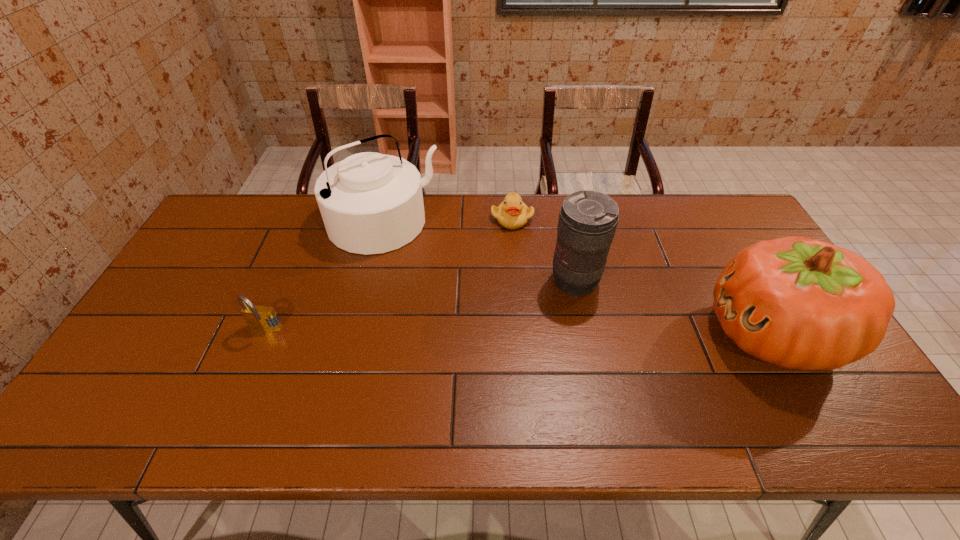
At what (x,y) coordinates should I click in order to perform the action: click on vacant region between the telephoto lens and the shortest object. Please return your answer as a coordinate pair (x, y). The width and height of the screenshot is (960, 540). Looking at the image, I should click on (543, 249).

Select which object is the closest to the rightmost object. Please provide its 2D coordinates. Your answer should be formatted as a tuple, i.e. [(x, y)], where the tuple contains the x and y coordinates of a point satisfying the conditions above.

[(587, 222)]

The image size is (960, 540). What are the coordinates of `object that is the fourth closest to the leftmost object` in the screenshot? It's located at (799, 303).

You are a GUI agent. You are given a task and a screenshot of the screen. Output one action in this format:
    pyautogui.click(x=<x>, y=<y>)
    Task: Click on the vacant space that satisfies the following two spatial constraints: 1. on the side with the combination dials of the rightmost object; 2. on the side of the padlock with the cute face
    
    Given the screenshot: What is the action you would take?
    pyautogui.click(x=263, y=334)

Identify the location of vacant space that satisfies the following two spatial constraints: 1. on the front side of the pumpkin; 2. on the side of the duckling with the cute face. The image size is (960, 540). (521, 334).

The width and height of the screenshot is (960, 540). I want to click on free point that satisfies the following two spatial constraints: 1. on the front side of the kettle; 2. on the side of the rightmost object with the cute face, so click(x=356, y=334).

You are a GUI agent. You are given a task and a screenshot of the screen. Output one action in this format:
    pyautogui.click(x=<x>, y=<y>)
    Task: Click on the free spot that satisfies the following two spatial constraints: 1. on the front side of the kettle; 2. on the side of the rightmost object with the cute face
    
    Given the screenshot: What is the action you would take?
    pyautogui.click(x=356, y=334)

Find the location of a particular element. Image resolution: width=960 pixels, height=540 pixels. free location that satisfies the following two spatial constraints: 1. on the front side of the kettle; 2. on the side of the rightmost object with the cute face is located at coordinates (356, 334).

At what (x,y) coordinates should I click in order to perform the action: click on vacant region that satisfies the following two spatial constraints: 1. on the side with the combination dials of the fourth tallest object; 2. on the side of the rightmost object with the cute face. Please return your answer as a coordinate pair (x, y). Looking at the image, I should click on (263, 334).